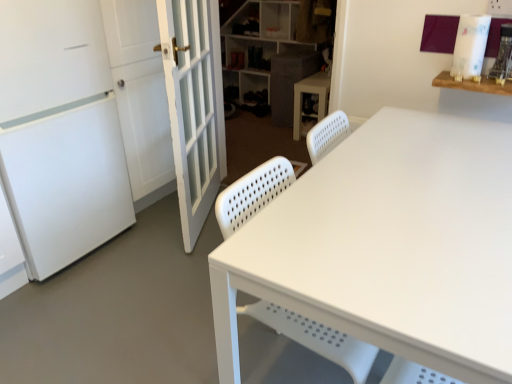
The width and height of the screenshot is (512, 384). I want to click on free spot in front of white glass door at left, so click(x=157, y=275).